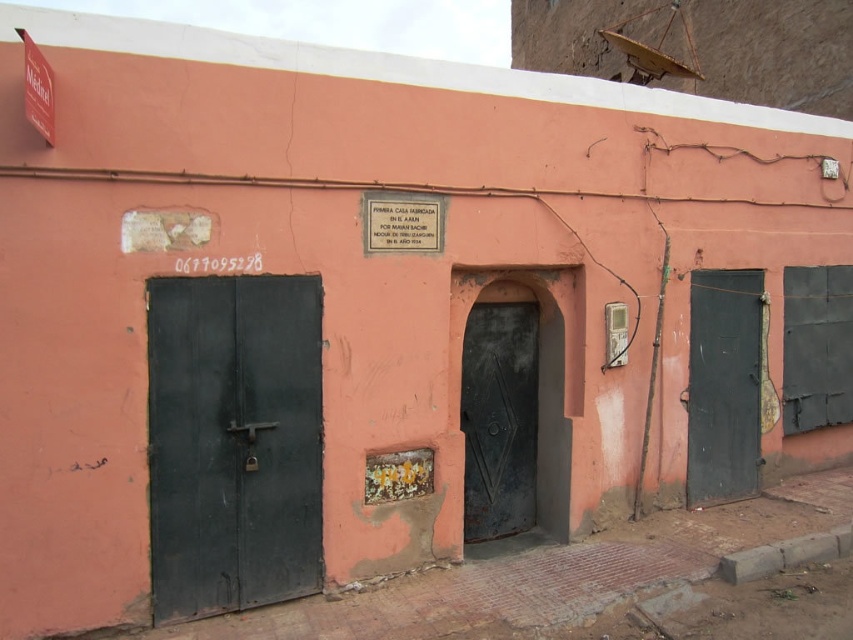
Question: Which point is closer to the camera?

Choices:
 (A) matte black door at left
 (B) matte black door at right
 (C) rusty metal door at center

Answer: (A)

Question: Can you confirm if matte black door at left is positioned below matte black door at right?

Choices:
 (A) yes
 (B) no

Answer: (A)

Question: Is matte black door at left thinner than matte black door at right?

Choices:
 (A) yes
 (B) no

Answer: (B)

Question: Which point is farther to the camera?

Choices:
 (A) matte black door at right
 (B) rusty metal door at center
 (C) matte black door at left

Answer: (A)

Question: From the image, what is the correct spatial relationship of matte black door at left in relation to rusty metal door at center?

Choices:
 (A) above
 (B) below

Answer: (A)

Question: Estimate the real-world distances between objects in this image. Which object is farther from the matte black door at right?

Choices:
 (A) matte black door at left
 (B) rusty metal door at center

Answer: (A)